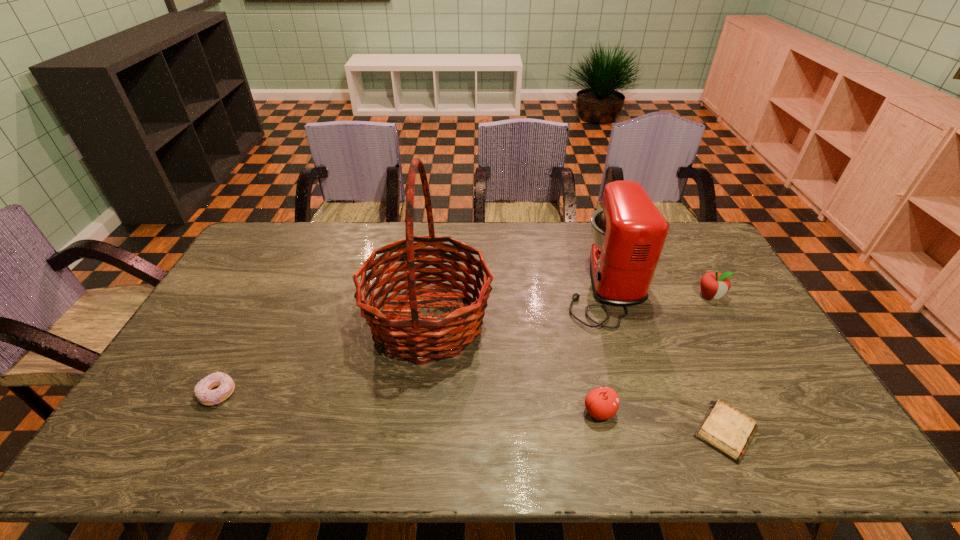
Find the location of a particular element. Image resolution: width=960 pixels, height=540 pixels. free region located 0.050m on the back of the second object from left to right is located at coordinates (434, 270).

Locate an element on the screen. The height and width of the screenshot is (540, 960). free space located 0.300m on the front-facing side of the kitchen mixer is located at coordinates (473, 285).

The height and width of the screenshot is (540, 960). I want to click on free location located 0.320m on the front-facing side of the kitchen mixer, so click(x=468, y=285).

Find the location of `blank space located 0.080m on the front-facing side of the kitchen mixer`. blank space located 0.080m on the front-facing side of the kitchen mixer is located at coordinates (540, 285).

The height and width of the screenshot is (540, 960). Find the location of `vacant space located on the back of the farther apple`. vacant space located on the back of the farther apple is located at coordinates (680, 244).

Find the location of `vacant space located on the left of the shorter apple`. vacant space located on the left of the shorter apple is located at coordinates (492, 411).

Find the location of a particular element. This screenshot has width=960, height=540. free space located 0.130m on the right of the second shortest object is located at coordinates (285, 394).

Find the location of a particular element. The width and height of the screenshot is (960, 540). free spot located 0.130m on the left of the diary is located at coordinates (638, 431).

Locate an element on the screen. This screenshot has height=540, width=960. object that is at the far edge is located at coordinates (629, 232).

This screenshot has width=960, height=540. What are the coordinates of `object situated at the near edge` in the screenshot? It's located at (727, 430).